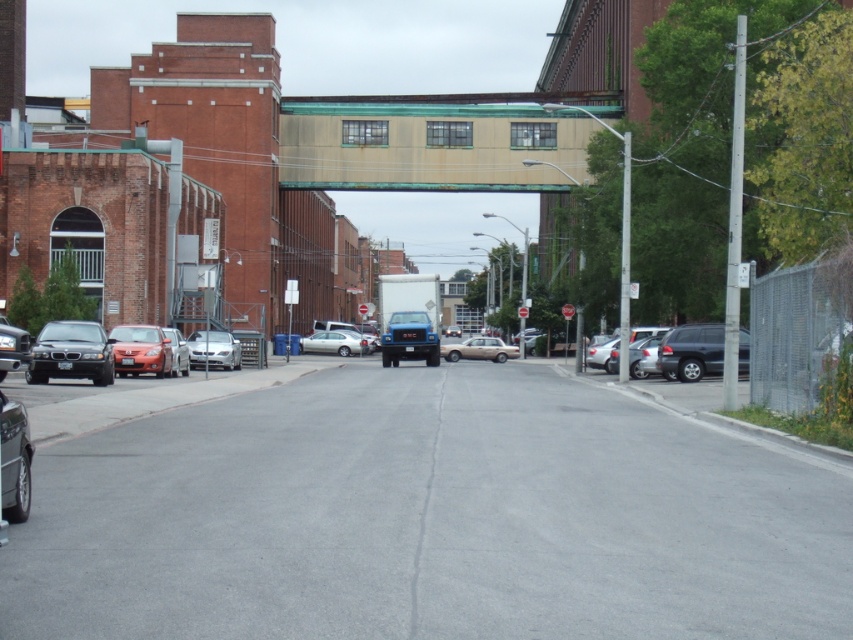
You are a delivery driver who needs to park your truck, which is 2 meters wide, between the shiny black sedan at left and the gold metallic sedan at center. Can you fit your truck there?

The shiny black sedan at left is narrower than the gold metallic sedan at center. However, the distance between them isn not specified in the objects description. Therefore, it is impossible to determine if the truck can fit based on the given information.

You are standing on the street and want to take a photo of both point (164, 337) and point (486, 340). Which point should you focus on first to ensure both are in clear view?

You should focus on point (164, 337) first because it is closer to the camera, ensuring both points will be in focus when using a depth of field that includes both distances.

You are a delivery driver needing to park your van between the shiny black sedan at left and the gold metallic sedan at center. Can you fit your van, which is 2 meters wide, in the space between them?

The shiny black sedan at left is positioned over gold metallic sedan at center, so there is no space between them. Your van cannot fit in the space between the shiny black sedan at left and the gold metallic sedan at center.